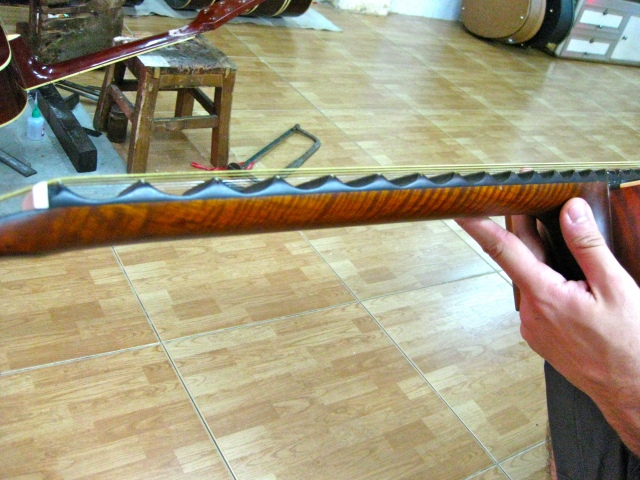
The image size is (640, 480). What are the coordinates of `drawers` in the screenshot? It's located at (x=594, y=25).